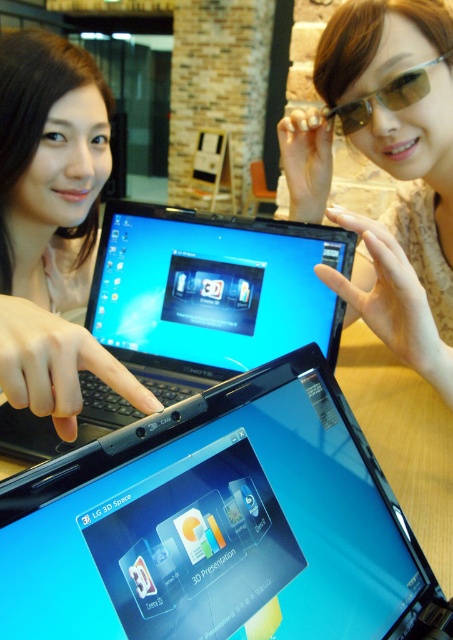
You are a virtual reality designer who needs to place a new 3D object between the sunglasses at upper center and the gold metallic goggles at upper right. Based on their positions, which object is closer to you and should the new object be placed closer to it?

The sunglasses at upper center is closer to the viewer than the gold metallic goggles at upper right. Therefore, the new object should be placed closer to the sunglasses at upper center to maintain spatial coherence.

Based on the photo, you are a customer at a tech store and want to place a pair of sunglasses at upper center and a pair of gold metallic goggles at upper right on a shelf. The shelf has a width of 4 inches. Can both items fit side by side without overlapping?

The distance between sunglasses at upper center and gold metallic goggles at upper right is 3.79 inches, which is less than the shelf width of 4 inches. Therefore, both items can fit side by side without overlapping.